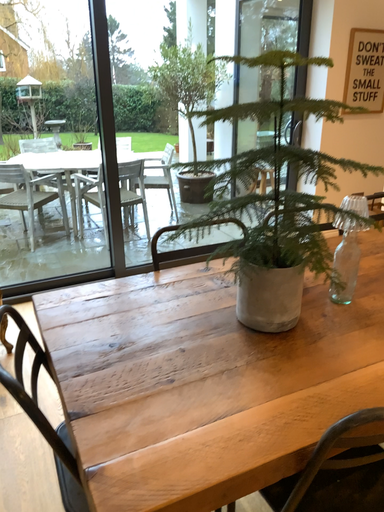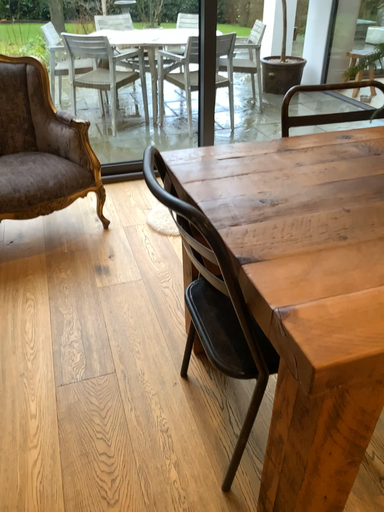
Question: How did the camera likely rotate when shooting the video?

Choices:
 (A) rotated downward
 (B) rotated upward

Answer: (A)